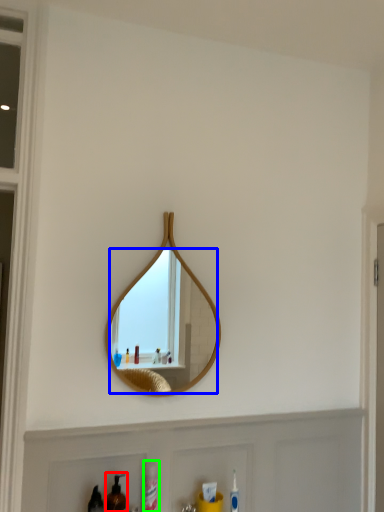
Question: Which object is positioned closest to mouthwash (highlighted by a red box)? Select from mirror (highlighted by a blue box) and cleaning product (highlighted by a green box).

Choices:
 (A) mirror
 (B) cleaning product

Answer: (B)